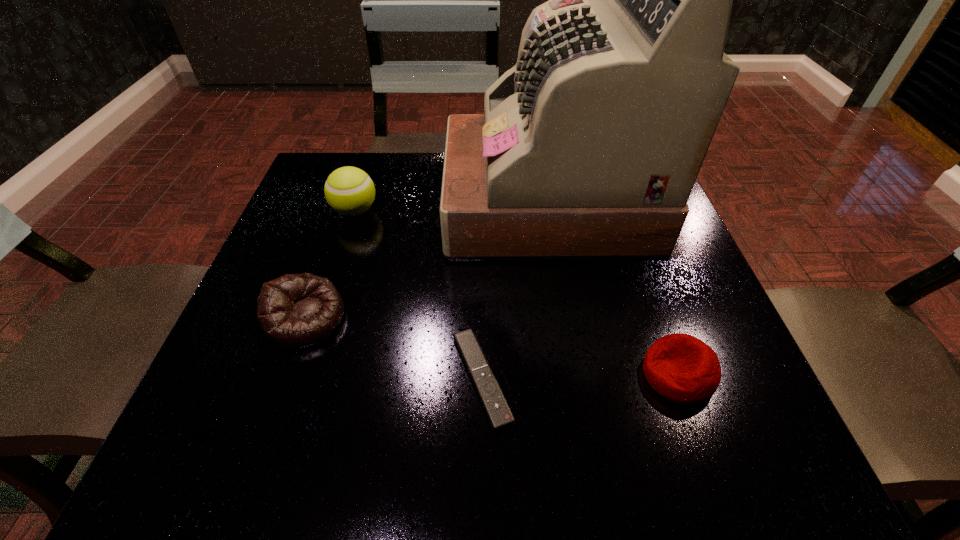
Locate an element on the screen. This screenshot has width=960, height=540. the tallest object is located at coordinates (589, 147).

This screenshot has width=960, height=540. Identify the location of tennis ball. (349, 191).

The image size is (960, 540). In order to click on the left beanbag in this screenshot , I will do `click(295, 311)`.

Locate an element on the screen. The image size is (960, 540). the right beanbag is located at coordinates (682, 368).

Find the location of a particular element. the shortest object is located at coordinates (493, 400).

At what (x,y) coordinates should I click in order to perform the action: click on vacant space located on the operating side of the cash register. Please return your answer as a coordinate pair (x, y). This screenshot has width=960, height=540. Looking at the image, I should click on (350, 203).

Where is `vacant region located 0.260m on the operating side of the cash register`? The image size is (960, 540). vacant region located 0.260m on the operating side of the cash register is located at coordinates (333, 203).

Locate an element on the screen. The image size is (960, 540). vacant area situated 0.100m on the operating side of the cash register is located at coordinates (403, 203).

Identify the location of vacant space situated 0.050m on the right of the second tallest object. The height and width of the screenshot is (540, 960). (401, 211).

Where is `vacant space situated 0.140m on the back of the left beanbag`? The image size is (960, 540). vacant space situated 0.140m on the back of the left beanbag is located at coordinates (333, 240).